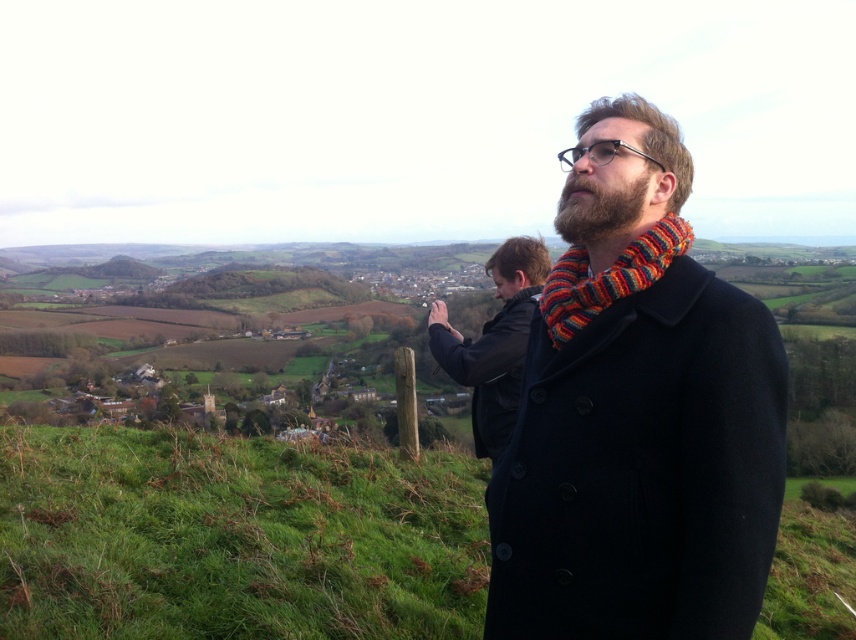
Is knitted wool scarf at center wider than knitted multicolor scarf at right?

Correct, the width of knitted wool scarf at center exceeds that of knitted multicolor scarf at right.

Between point (672, 240) and point (635, 285), which one is positioned in front?

Point (635, 285) is more forward.

Find the location of a particular element. The image size is (856, 640). knitted wool scarf at center is located at coordinates (639, 426).

I want to click on knitted wool scarf at center, so click(639, 426).

Who is higher up, knitted wool scarf at center or black leather jacket at center?

Positioned higher is knitted wool scarf at center.

Is point (583, 417) behind point (431, 305)?

No, it is in front of (431, 305).

Is point (752, 296) closer to viewer compared to point (498, 376)?

Yes, point (752, 296) is closer to viewer.

At what (x,y) coordinates should I click in order to perform the action: click on knitted wool scarf at center. Please return your answer as a coordinate pair (x, y). This screenshot has height=640, width=856. Looking at the image, I should click on (639, 426).

Between knitted wool scarf at center and dark brown beard at center, which one appears on the left side from the viewer's perspective?

knitted wool scarf at center

Consider the image. Which of these two, knitted wool scarf at center or dark brown beard at center, stands taller?

With more height is knitted wool scarf at center.

Find the location of `knitted wool scarf at center`. knitted wool scarf at center is located at coordinates (639, 426).

This screenshot has width=856, height=640. Identify the location of knitted wool scarf at center. (639, 426).